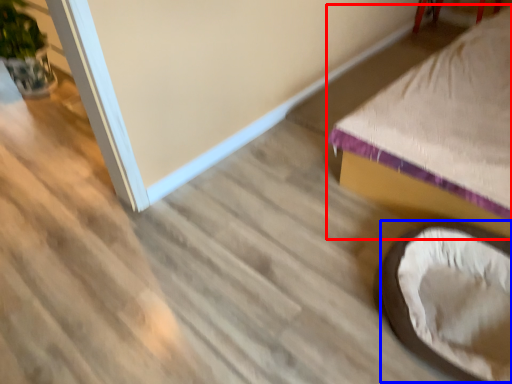
Question: Which object appears closest to the camera in this image, furniture (highlighted by a red box) or bean bag chair (highlighted by a blue box)?

Choices:
 (A) furniture
 (B) bean bag chair

Answer: (A)